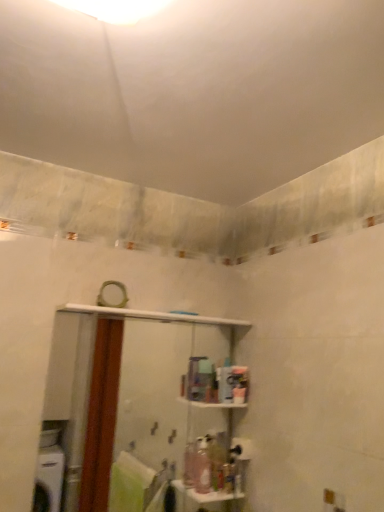
What do you see at coordinates (112, 295) in the screenshot?
I see `matte white mirror at upper center` at bounding box center [112, 295].

This screenshot has height=512, width=384. What do you see at coordinates (202, 467) in the screenshot? I see `pink plastic bottle at center, arranged as the 1th toiletry when viewed from the left` at bounding box center [202, 467].

Identify the location of white glossy shelf at center. (134, 400).

Which object is positioned more to the right, matte white mirror at upper center or white glossy shelf at center?

white glossy shelf at center.

Measure the distance between matte white mirror at upper center and white glossy shelf at center.

The distance of matte white mirror at upper center from white glossy shelf at center is 91.72 centimeters.

From the image's perspective, does matte white mirror at upper center appear higher than white glossy shelf at center?

Yes.

This screenshot has width=384, height=512. Identify the location of shelf below the matte white mirror at upper center (from the image's perspective). (134, 400).

From the image's perspective, would you say matte white mirror at upper center is positioned over pink plastic bottle at center, the second toiletry from the right?

Yes, from the image's perspective, matte white mirror at upper center is on top of pink plastic bottle at center, the second toiletry from the right.

Is matte white mirror at upper center facing towards pink plastic bottle at center, arranged as the 1th toiletry when viewed from the left?

No, matte white mirror at upper center is not oriented towards pink plastic bottle at center, arranged as the 1th toiletry when viewed from the left.

Considering the points (124, 285) and (202, 468), which point is in front, point (124, 285) or point (202, 468)?

The point (124, 285) is closer to the camera.

Looking at this image, how different are the orientations of matte white mirror at upper center and pink plastic bottle at center, the second toiletry from the right, in degrees?

10.8 degrees separate the facing orientations of matte white mirror at upper center and pink plastic bottle at center, the second toiletry from the right.

From the image's perspective, between matte white mirror at upper center and translucent plastic soap dispenser at lower center, marked as the second toiletry in a left-to-right arrangement, who is located below?

translucent plastic soap dispenser at lower center, marked as the second toiletry in a left-to-right arrangement, appears lower in the image.

Can you confirm if matte white mirror at upper center is shorter than translucent plastic soap dispenser at lower center, the first toiletry in the right-to-left sequence?

Yes.

Is matte white mirror at upper center beside translucent plastic soap dispenser at lower center, marked as the second toiletry in a left-to-right arrangement?

matte white mirror at upper center and translucent plastic soap dispenser at lower center, marked as the second toiletry in a left-to-right arrangement, are not in contact.

What's the angular difference between pink plastic bottle at center, the second toiletry from the right, and matte white mirror at upper center's facing directions?

The angular difference between pink plastic bottle at center, the second toiletry from the right, and matte white mirror at upper center is 10.8 degrees.

Which of these two, pink plastic bottle at center, the second toiletry from the right, or matte white mirror at upper center, stands taller?

Standing taller between the two is pink plastic bottle at center, the second toiletry from the right.

Is pink plastic bottle at center, arranged as the 1th toiletry when viewed from the left, spatially inside matte white mirror at upper center, or outside of it?

pink plastic bottle at center, arranged as the 1th toiletry when viewed from the left, is not enclosed by matte white mirror at upper center.

Is the depth of white glossy shelf at center greater than that of matte white mirror at upper center?

No.

Measure the distance between white glossy shelf at center and matte white mirror at upper center.

white glossy shelf at center is 91.72 centimeters away from matte white mirror at upper center.

From the image's perspective, is white glossy shelf at center under matte white mirror at upper center?

Indeed, from the image's perspective, white glossy shelf at center is shown beneath matte white mirror at upper center.

Which object is positioned more to the left, white glossy shelf at center or matte white mirror at upper center?

matte white mirror at upper center is more to the left.

The height and width of the screenshot is (512, 384). Find the location of `toiletry above the translucent plastic soap dispenser at lower center, the first toiletry in the right-to-left sequence (from the image's perspective)`. toiletry above the translucent plastic soap dispenser at lower center, the first toiletry in the right-to-left sequence (from the image's perspective) is located at coordinates (202, 467).

Is translucent plastic soap dispenser at lower center, marked as the second toiletry in a left-to-right arrangement, facing towards pink plastic bottle at center, the second toiletry from the right?

No, translucent plastic soap dispenser at lower center, marked as the second toiletry in a left-to-right arrangement, is not aimed at pink plastic bottle at center, the second toiletry from the right.

Considering the points (226, 487) and (199, 474), which point is behind, point (226, 487) or point (199, 474)?

Point (199, 474)

Is translucent plastic soap dispenser at lower center, marked as the second toiletry in a left-to-right arrangement, situated inside white glossy shelf at center or outside?

translucent plastic soap dispenser at lower center, marked as the second toiletry in a left-to-right arrangement, is not inside white glossy shelf at center, it's outside.

In terms of width, does translucent plastic soap dispenser at lower center, marked as the second toiletry in a left-to-right arrangement, look wider or thinner when compared to white glossy shelf at center?

Considering their sizes, translucent plastic soap dispenser at lower center, marked as the second toiletry in a left-to-right arrangement, looks slimmer than white glossy shelf at center.

Based on the photo, how many degrees apart are the facing directions of translucent plastic soap dispenser at lower center, marked as the second toiletry in a left-to-right arrangement, and white glossy shelf at center?

The facing directions of translucent plastic soap dispenser at lower center, marked as the second toiletry in a left-to-right arrangement, and white glossy shelf at center are 0.0926 degrees apart.

In order to click on shelf on the right of matte white mirror at upper center in this screenshot , I will do `click(134, 400)`.

From a real-world perspective, which toiletry is the 1st one underneath the matte white mirror at upper center? Please provide its 2D coordinates.

[(202, 467)]

From the image, which object appears to be farther from pink plastic bottle at center, arranged as the 1th toiletry when viewed from the left, matte white mirror at upper center or white glossy shelf at center?

Among the two, matte white mirror at upper center is located further to pink plastic bottle at center, arranged as the 1th toiletry when viewed from the left.

Considering their positions, is matte white mirror at upper center positioned further to white glossy shelf at center than translucent plastic soap dispenser at lower center, marked as the second toiletry in a left-to-right arrangement?

matte white mirror at upper center.

From the image, which object appears to be nearer to matte white mirror at upper center, white glossy shelf at center or translucent plastic soap dispenser at lower center, the first toiletry in the right-to-left sequence?

Among the two, translucent plastic soap dispenser at lower center, the first toiletry in the right-to-left sequence, is located nearer to matte white mirror at upper center.

From the image, which object appears to be farther from pink plastic bottle at center, the second toiletry from the right, translucent plastic soap dispenser at lower center, the first toiletry in the right-to-left sequence, or matte white mirror at upper center?

Based on the image, matte white mirror at upper center appears to be further to pink plastic bottle at center, the second toiletry from the right.

Looking at the image, which one is located closer to matte white mirror at upper center, white glossy shelf at center or pink plastic bottle at center, the second toiletry from the right?

Among the two, pink plastic bottle at center, the second toiletry from the right, is located nearer to matte white mirror at upper center.

Which object lies nearer to the anchor point pink plastic bottle at center, arranged as the 1th toiletry when viewed from the left, white glossy shelf at center or matte white mirror at upper center?

white glossy shelf at center is closer to pink plastic bottle at center, arranged as the 1th toiletry when viewed from the left.

Estimate the real-world distances between objects in this image. Which object is closer to translucent plastic soap dispenser at lower center, the first toiletry in the right-to-left sequence, pink plastic bottle at center, the second toiletry from the right, or matte white mirror at upper center?

pink plastic bottle at center, the second toiletry from the right, is positioned closer to the anchor translucent plastic soap dispenser at lower center, the first toiletry in the right-to-left sequence.

Which object lies nearer to the anchor point white glossy shelf at center, pink plastic bottle at center, the second toiletry from the right, or translucent plastic soap dispenser at lower center, marked as the second toiletry in a left-to-right arrangement?

The object closer to white glossy shelf at center is pink plastic bottle at center, the second toiletry from the right.

This screenshot has width=384, height=512. Identify the location of shelf that lies between matte white mirror at upper center and translucent plastic soap dispenser at lower center, the first toiletry in the right-to-left sequence, from top to bottom. (134, 400).

I want to click on shelf between matte white mirror at upper center and pink plastic bottle at center, the second toiletry from the right, from top to bottom, so click(x=134, y=400).

Image resolution: width=384 pixels, height=512 pixels. What are the coordinates of `toiletry between matte white mirror at upper center and translucent plastic soap dispenser at lower center, marked as the second toiletry in a left-to-right arrangement, vertically` in the screenshot? It's located at (202, 467).

Locate an element on the screen. The height and width of the screenshot is (512, 384). toiletry situated between white glossy shelf at center and translucent plastic soap dispenser at lower center, the first toiletry in the right-to-left sequence, from left to right is located at coordinates (202, 467).